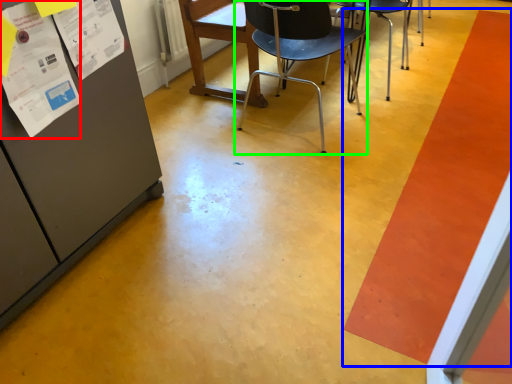
Question: Which object is the closest to the poster (highlighted by a red box)? Choose among these: strip (highlighted by a blue box) or chair (highlighted by a green box).

Choices:
 (A) strip
 (B) chair

Answer: (B)